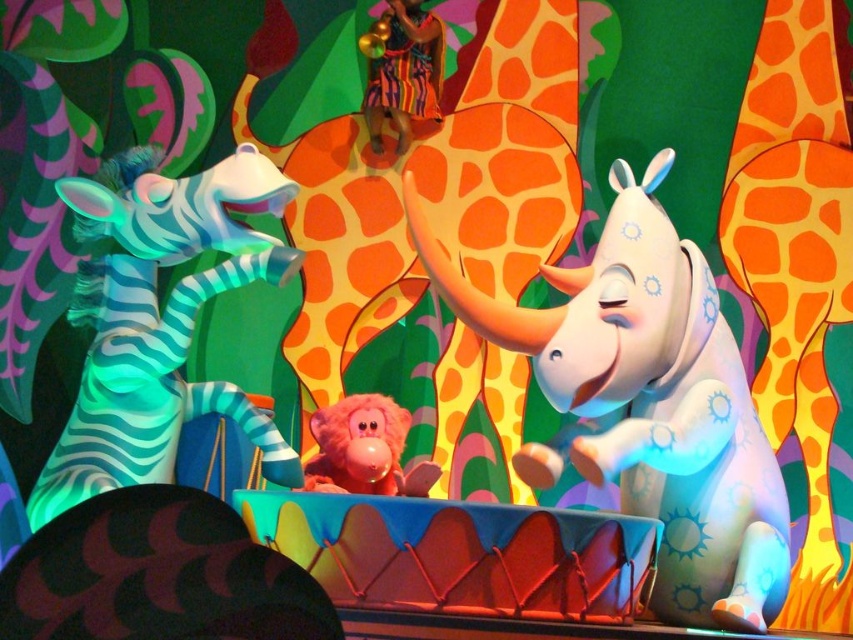
You are a child playing in a jungle themed room. You see a pink plush monkey at center and a multicolored fabric toy at upper center. Which toy is closer to the left side of the room?

The pink plush monkey at center is closer to the left side of the room because it is positioned to the left of the multicolored fabric toy at upper center.

You are a child trying to decide which fabric to play with. The orange spotted fabric at right and the multicolored fabric toy at upper center are both in front of you. Which one is wider?

The multicolored fabric toy at upper center is wider than the orange spotted fabric at right.